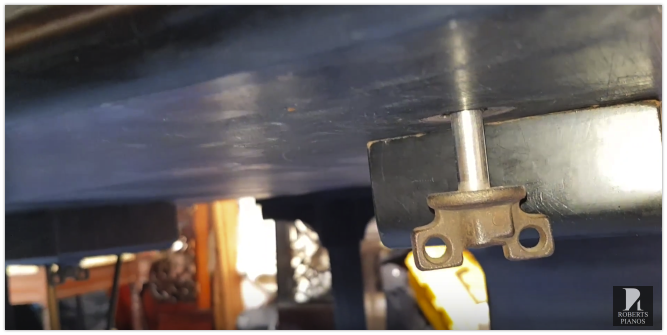
Identify the location of chair. (27, 289).